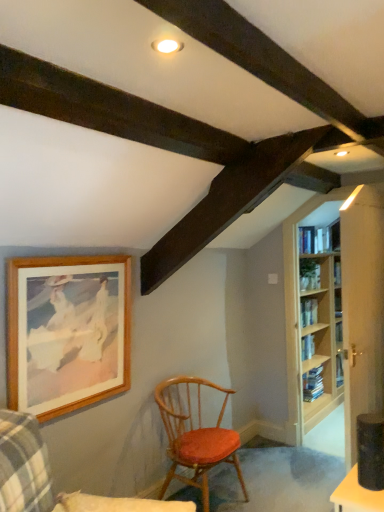
Measure the distance between point (111, 497) and camera.

Point (111, 497) is 2.36 meters away from camera.

The height and width of the screenshot is (512, 384). What are the coordinates of `light wood bookcase at right` in the screenshot? It's located at (337, 313).

Find the location of a particular element. The height and width of the screenshot is (512, 384). wooden chair with red cushion at center, the first chair from the back is located at coordinates (195, 436).

Looking at this image, is wooden picture frame at upper left directly adjacent to light wood bookcase at right?

No.

Which of these two, wooden picture frame at upper left or light wood bookcase at right, stands taller?

light wood bookcase at right is taller.

Choose the correct answer: Is wooden picture frame at upper left inside light wood bookcase at right or outside it?

wooden picture frame at upper left is not enclosed by light wood bookcase at right.

Is wooden picture frame at upper left at the right side of light wood bookcase at right?

No, wooden picture frame at upper left is not to the right of light wood bookcase at right.

Considering the relative sizes of wooden chair with red cushion at center, acting as the 2th chair starting from the front, and light wood bookcase at right in the image provided, is wooden chair with red cushion at center, acting as the 2th chair starting from the front, bigger than light wood bookcase at right?

Actually, wooden chair with red cushion at center, acting as the 2th chair starting from the front, might be smaller than light wood bookcase at right.

From the image's perspective, who appears lower, wooden chair with red cushion at center, the first chair from the back, or light wood bookcase at right?

From the image's view, wooden chair with red cushion at center, the first chair from the back, is below.

Is wooden chair with red cushion at center, the first chair from the back, turned away from light wood bookcase at right?

No, wooden chair with red cushion at center, the first chair from the back, is not facing away from light wood bookcase at right.

Does light wood bookcase at right have a smaller size compared to wooden picture frame at upper left?

No, light wood bookcase at right is not smaller than wooden picture frame at upper left.

Is light wood bookcase at right positioned with its back to wooden picture frame at upper left?

No, light wood bookcase at right is not facing away from wooden picture frame at upper left.

Does light wood bookcase at right have a greater width compared to wooden picture frame at upper left?

Yes, light wood bookcase at right is wider than wooden picture frame at upper left.

From a real-world perspective, who is located lower, light wood bookcase at right or wooden picture frame at upper left?

light wood bookcase at right is physically lower.

From the picture: Is wooden chair with red cushion at center, the first chair from the back, at the back of light wood bookcase at right?

No, light wood bookcase at right is not facing away from wooden chair with red cushion at center, the first chair from the back.

Does light wood bookcase at right have a greater height compared to wooden chair with red cushion at center, the first chair from the back?

Yes, light wood bookcase at right is taller than wooden chair with red cushion at center, the first chair from the back.

Considering the relative positions of light wood bookcase at right and wooden chair with red cushion at center, the first chair from the back, in the image provided, is light wood bookcase at right to the left of wooden chair with red cushion at center, the first chair from the back, from the viewer's perspective?

No.

From the image's perspective, which one is positioned higher, light wood bookcase at right or wooden chair with red cushion at center, the first chair from the back?

light wood bookcase at right is shown above in the image.

Can you confirm if light wood bookcase at right is wider than wooden chair with red cushion at center, the second chair from the back?

In fact, light wood bookcase at right might be narrower than wooden chair with red cushion at center, the second chair from the back.

Is wooden chair with red cushion at center, the first chair from the front, at the back of light wood bookcase at right?

No.

Does point (352, 301) come farther from viewer compared to point (172, 509)?

Yes.

Is light wood bookcase at right in front of wooden chair with red cushion at center, the first chair from the front?

No, light wood bookcase at right is further to the viewer.

Is wooden picture frame at upper left to the left or to the right of wooden chair with red cushion at center, the first chair from the back, in the image?

In the image, wooden picture frame at upper left appears on the left side of wooden chair with red cushion at center, the first chair from the back.

How many degrees apart are the facing directions of wooden picture frame at upper left and wooden chair with red cushion at center, acting as the 2th chair starting from the front?

The angular difference between wooden picture frame at upper left and wooden chair with red cushion at center, acting as the 2th chair starting from the front, is 0.00146 degrees.

Is point (47, 402) farther from viewer compared to point (158, 497)?

No, (47, 402) is closer to viewer.

Looking at the image, does wooden picture frame at upper left seem bigger or smaller compared to wooden chair with red cushion at center, acting as the 2th chair starting from the front?

In the image, wooden picture frame at upper left appears to be smaller than wooden chair with red cushion at center, acting as the 2th chair starting from the front.

Considering the positions of point (177, 509) and point (233, 447), is point (177, 509) closer or farther from the camera than point (233, 447)?

Clearly, point (177, 509) is closer to the camera than point (233, 447).

Is wooden chair with red cushion at center, the first chair from the front, positioned behind wooden chair with red cushion at center, the first chair from the back?

No, wooden chair with red cushion at center, the first chair from the front, is closer to the viewer.

From the image's perspective, which is above, wooden chair with red cushion at center, the second chair from the back, or wooden chair with red cushion at center, the first chair from the back?

From the image's view, wooden chair with red cushion at center, the second chair from the back, is above.

The image size is (384, 512). Find the location of `bookcase lying below the wooden picture frame at upper left (from the image's perspective)`. bookcase lying below the wooden picture frame at upper left (from the image's perspective) is located at coordinates (337, 313).

The image size is (384, 512). I want to click on bookcase above the wooden chair with red cushion at center, the first chair from the back (from the image's perspective), so click(x=337, y=313).

Based on their spatial positions, is light wood bookcase at right or wooden picture frame at upper left further from wooden chair with red cushion at center, acting as the 2th chair starting from the front?

Among the two, light wood bookcase at right is located further to wooden chair with red cushion at center, acting as the 2th chair starting from the front.

Looking at this image, based on their spatial positions, is wooden chair with red cushion at center, the first chair from the back, or wooden chair with red cushion at center, the first chair from the front, closer to wooden picture frame at upper left?

wooden chair with red cushion at center, the first chair from the front, is closer to wooden picture frame at upper left.

When comparing their distances from wooden chair with red cushion at center, the first chair from the back, does wooden picture frame at upper left or light wood bookcase at right seem closer?

Among the two, wooden picture frame at upper left is located nearer to wooden chair with red cushion at center, the first chair from the back.

When comparing their distances from wooden chair with red cushion at center, the first chair from the front, does wooden picture frame at upper left or wooden chair with red cushion at center, the first chair from the back, seem closer?

wooden picture frame at upper left lies closer to wooden chair with red cushion at center, the first chair from the front, than the other object.

Which object lies further to the anchor point light wood bookcase at right, wooden chair with red cushion at center, the second chair from the back, or wooden picture frame at upper left?

wooden chair with red cushion at center, the second chair from the back, lies further to light wood bookcase at right than the other object.

When comparing their distances from wooden picture frame at upper left, does light wood bookcase at right or wooden chair with red cushion at center, the second chair from the back, seem closer?

Among the two, wooden chair with red cushion at center, the second chair from the back, is located nearer to wooden picture frame at upper left.

When comparing their distances from wooden chair with red cushion at center, acting as the 2th chair starting from the front, does wooden picture frame at upper left or wooden chair with red cushion at center, the first chair from the front, seem further?

Based on the image, wooden chair with red cushion at center, the first chair from the front, appears to be further to wooden chair with red cushion at center, acting as the 2th chair starting from the front.

Considering their positions, is wooden chair with red cushion at center, the first chair from the back, positioned further to wooden picture frame at upper left than light wood bookcase at right?

Based on the image, light wood bookcase at right appears to be further to wooden picture frame at upper left.

Find the location of a particular element. picture frame between wooden chair with red cushion at center, the second chair from the back, and wooden chair with red cushion at center, the first chair from the back, in the front-back direction is located at coordinates (68, 332).

The height and width of the screenshot is (512, 384). I want to click on chair between wooden chair with red cushion at center, the first chair from the front, and light wood bookcase at right, so click(195, 436).